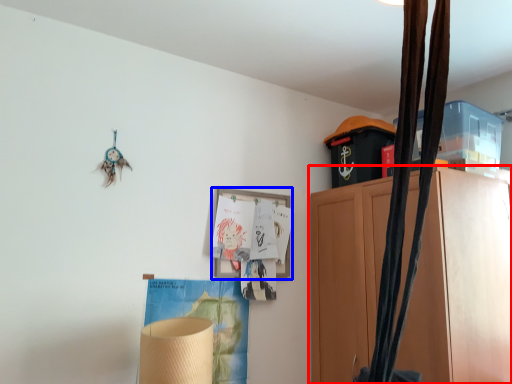
Question: Among these objects, which one is farthest to the camera, cabinetry (highlighted by a red box) or picture frame (highlighted by a blue box)?

Choices:
 (A) cabinetry
 (B) picture frame

Answer: (B)